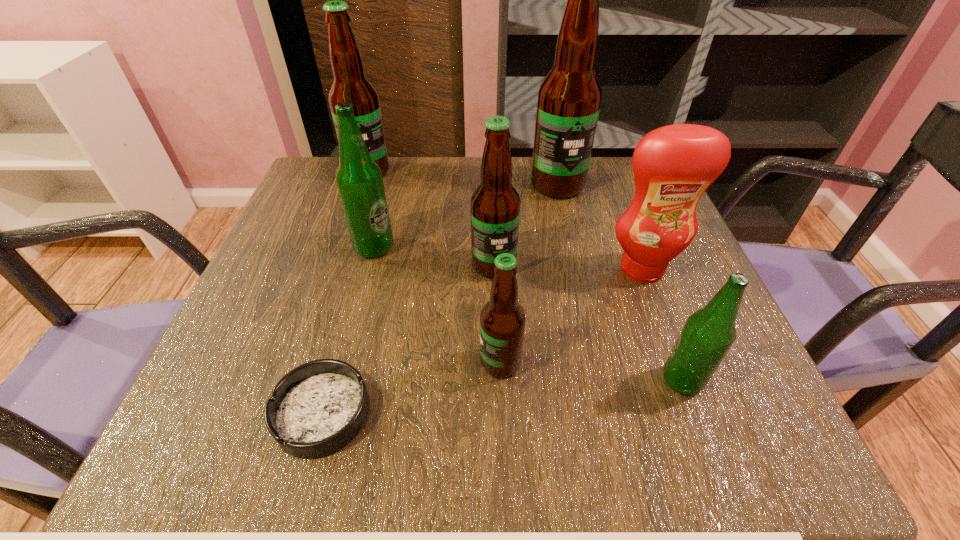
Find the location of a particular element. object that is positioned at the far left corner is located at coordinates (350, 85).

Where is `object situated at the near left corner`? This screenshot has width=960, height=540. object situated at the near left corner is located at coordinates (317, 408).

Locate an element on the screen. The width and height of the screenshot is (960, 540). free spot at the far edge of the desktop is located at coordinates (592, 199).

At what (x,y) coordinates should I click in order to perform the action: click on vacant area at the near edge. Please return your answer as a coordinate pair (x, y). This screenshot has height=540, width=960. Looking at the image, I should click on (537, 409).

Where is `free spot at the left edge of the desktop`? The image size is (960, 540). free spot at the left edge of the desktop is located at coordinates (280, 285).

Find the location of a particular element. This screenshot has width=960, height=540. vacant area at the right edge is located at coordinates (634, 305).

At what (x,y) coordinates should I click in order to perform the action: click on vacant point at the near left corner. Please return your answer as a coordinate pair (x, y). Looking at the image, I should click on (234, 423).

Where is `vacant area at the near right corner of the desktop`? vacant area at the near right corner of the desktop is located at coordinates (667, 430).

The height and width of the screenshot is (540, 960). In order to click on free area in between the second smallest brown beer bottle and the fifth beer bottle from left to right in this screenshot , I will do `click(525, 225)`.

Identify the location of empty location between the shortest object and the second smallest brown beer bottle. (408, 339).